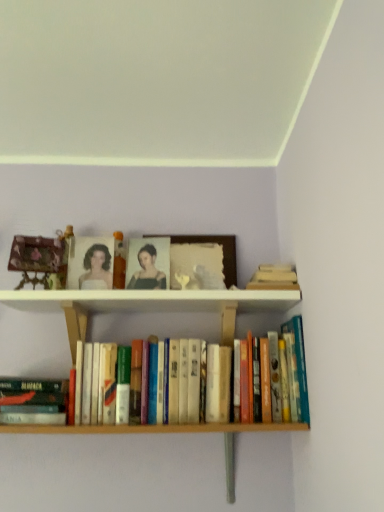
Question: Would you say hardcover book at lower left, the first book positioned from the left, is part of hardcover books at center, marked as the 2th book in a left-to-right arrangement,'s contents?

Choices:
 (A) yes
 (B) no

Answer: (B)

Question: Is hardcover books at center, marked as the 2th book in a left-to-right arrangement, next to hardcover book at lower left, which appears as the second book when viewed from the right?

Choices:
 (A) no
 (B) yes

Answer: (A)

Question: Would you consider hardcover books at center, marked as the 2th book in a left-to-right arrangement, to be distant from hardcover book at lower left, the first book positioned from the left?

Choices:
 (A) no
 (B) yes

Answer: (A)

Question: Is hardcover books at center, which is the first book from right to left, smaller than hardcover book at lower left, which appears as the second book when viewed from the right?

Choices:
 (A) yes
 (B) no

Answer: (B)

Question: Is hardcover books at center, which is the first book from right to left, oriented towards hardcover book at lower left, the first book positioned from the left?

Choices:
 (A) no
 (B) yes

Answer: (A)

Question: Looking at the image, does hardcover books at center, marked as the 2th book in a left-to-right arrangement, seem bigger or smaller compared to matte black portrait at center?

Choices:
 (A) big
 (B) small

Answer: (A)

Question: Considering the relative positions of hardcover books at center, marked as the 2th book in a left-to-right arrangement, and matte black portrait at center in the image provided, is hardcover books at center, marked as the 2th book in a left-to-right arrangement, to the left or to the right of matte black portrait at center?

Choices:
 (A) right
 (B) left

Answer: (A)

Question: Is hardcover books at center, which is the first book from right to left, inside the boundaries of matte black portrait at center, or outside?

Choices:
 (A) inside
 (B) outside

Answer: (B)

Question: From a real-world perspective, relative to matte black portrait at center, is hardcover books at center, which is the first book from right to left, vertically above or below?

Choices:
 (A) above
 (B) below

Answer: (B)

Question: Do you think matte black portrait at center is within hardcover book at lower left, which appears as the second book when viewed from the right, or outside of it?

Choices:
 (A) inside
 (B) outside

Answer: (B)

Question: Considering the positions of matte black portrait at center and hardcover book at lower left, the first book positioned from the left, in the image, is matte black portrait at center taller or shorter than hardcover book at lower left, the first book positioned from the left,?

Choices:
 (A) short
 (B) tall

Answer: (B)

Question: Considering the positions of matte black portrait at center and hardcover book at lower left, which appears as the second book when viewed from the right, in the image, is matte black portrait at center wider or thinner than hardcover book at lower left, which appears as the second book when viewed from the right,?

Choices:
 (A) wide
 (B) thin

Answer: (B)

Question: From a real-world perspective, is matte black portrait at center physically located above or below hardcover book at lower left, the first book positioned from the left?

Choices:
 (A) above
 (B) below

Answer: (A)

Question: Considering their positions, is wooden picture frame at center located in front of or behind hardcover books at center, which is the first book from right to left?

Choices:
 (A) behind
 (B) front

Answer: (A)

Question: Considering the positions of point (188, 237) and point (109, 424), is point (188, 237) closer or farther from the camera than point (109, 424)?

Choices:
 (A) closer
 (B) farther

Answer: (B)